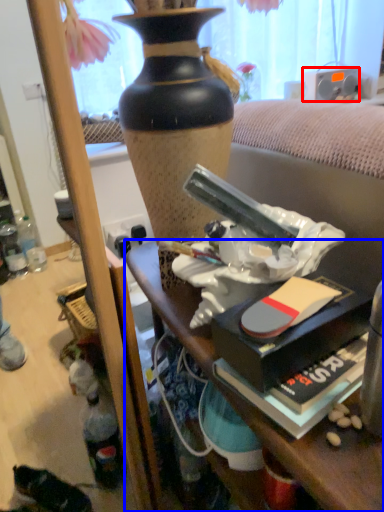
Question: Which point is further to the camera, loudspeaker (highlighted by a red box) or desk (highlighted by a blue box)?

Choices:
 (A) loudspeaker
 (B) desk

Answer: (A)